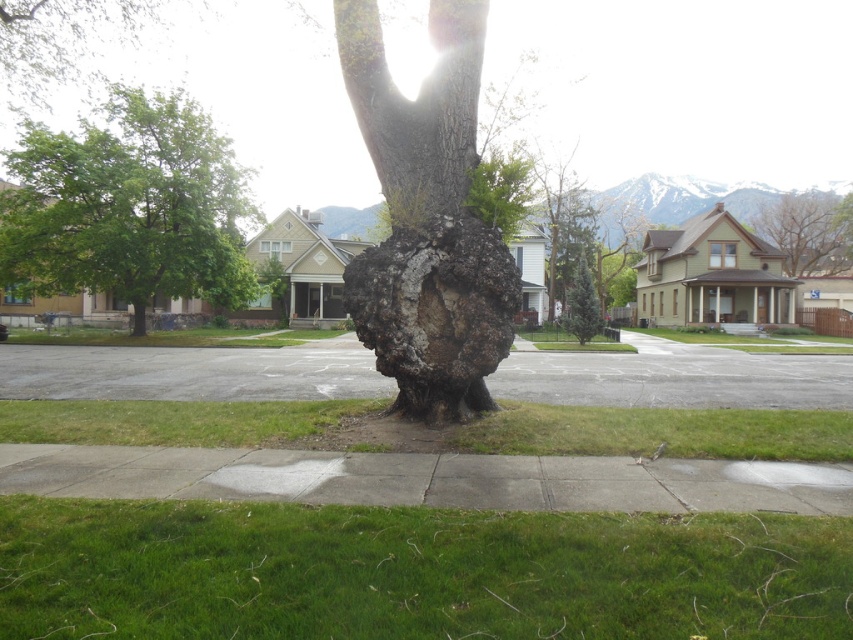
Question: Among these points, which one is nearest to the camera?

Choices:
 (A) (479, 508)
 (B) (392, 128)
 (C) (579, 260)

Answer: (A)

Question: Can you confirm if cracked bark tree trunk at center is bigger than gray asphalt pavement at center?

Choices:
 (A) yes
 (B) no

Answer: (B)

Question: Which point is farther to the camera?

Choices:
 (A) green grass at center
 (B) gray concrete sidewalk at center

Answer: (A)

Question: Is gray asphalt pavement at center below smooth bark tree at upper right?

Choices:
 (A) yes
 (B) no

Answer: (A)

Question: Is gray asphalt pavement at center to the right of green textured tree at center from the viewer's perspective?

Choices:
 (A) yes
 (B) no

Answer: (B)

Question: Estimate the real-world distances between objects in this image. Which object is farther from the rough bark tree trunk at center?

Choices:
 (A) cracked bark tree trunk at center
 (B) green grass at center
 (C) smooth bark tree trunk at center
 (D) green textured tree at center

Answer: (D)